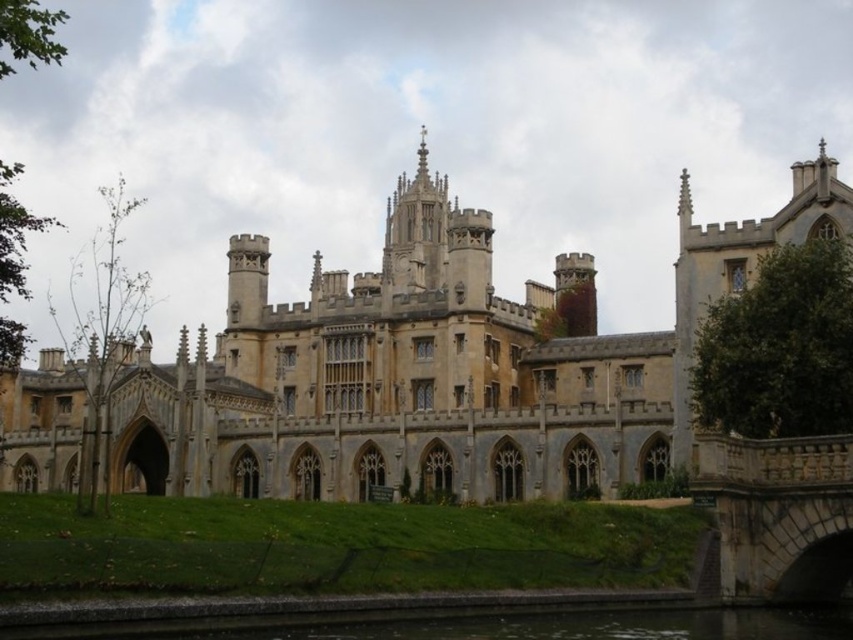
Based on the photo, you are standing at the riverbank looking at the grand historic building. There is a point marked at coordinates (434, 365) on the image. What does this point most likely represent?

The point at coordinates (434, 365) corresponds to the beige stone castle at center.

Consider the image. You are a tourist standing on the bridge overlooking the beige stone castle at center and the green concrete river at lower center. Which object appears bigger in the scene?

The beige stone castle at center appears bigger in the scene compared to the green concrete river at lower center as it has a larger size.

You are standing on the bank of the green concrete river at lower center and want to cross to the beige stone castle at center. Which direction should you walk to reach the castle?

The beige stone castle at center is positioned on the left side of green concrete river at lower center, so you should walk to the left to reach the castle.